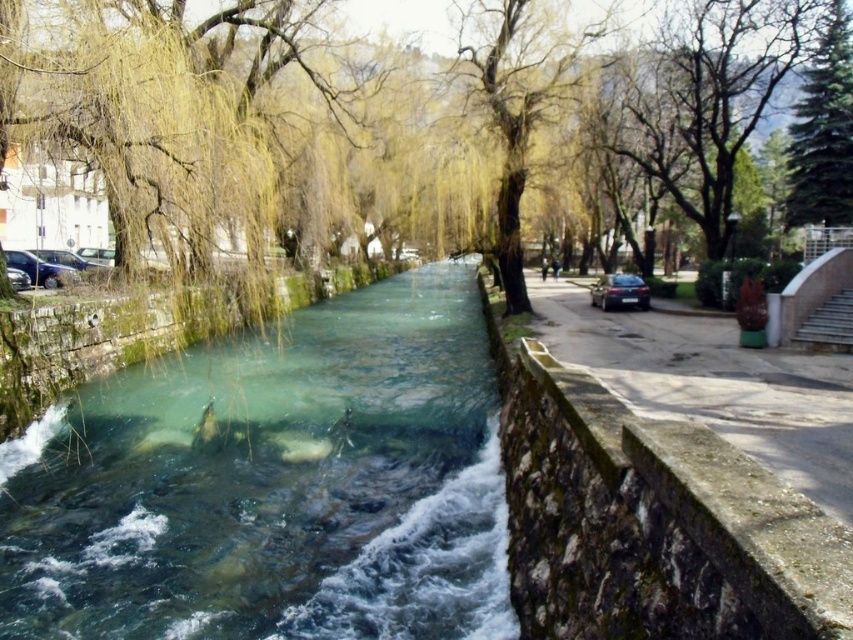
Question: Is clear stone stream at center further to the viewer compared to satin black car at right?

Choices:
 (A) yes
 (B) no

Answer: (B)

Question: Which object appears closest to the camera in this image?

Choices:
 (A) satin black car at right
 (B) matte black car at left

Answer: (B)

Question: Which object is the farthest from the satin black car at right?

Choices:
 (A) yellow-green leafy tree at center
 (B) green fir tree at upper right
 (C) matte black car at left

Answer: (C)

Question: Does clear stone stream at center have a smaller size compared to green fir tree at upper right?

Choices:
 (A) no
 (B) yes

Answer: (A)

Question: Does clear stone stream at center have a greater width compared to satin black car at right?

Choices:
 (A) no
 (B) yes

Answer: (B)

Question: Which of the following is the farthest from the observer?

Choices:
 (A) (9, 259)
 (B) (631, 305)
 (C) (321, 529)
 (D) (524, 49)

Answer: (B)